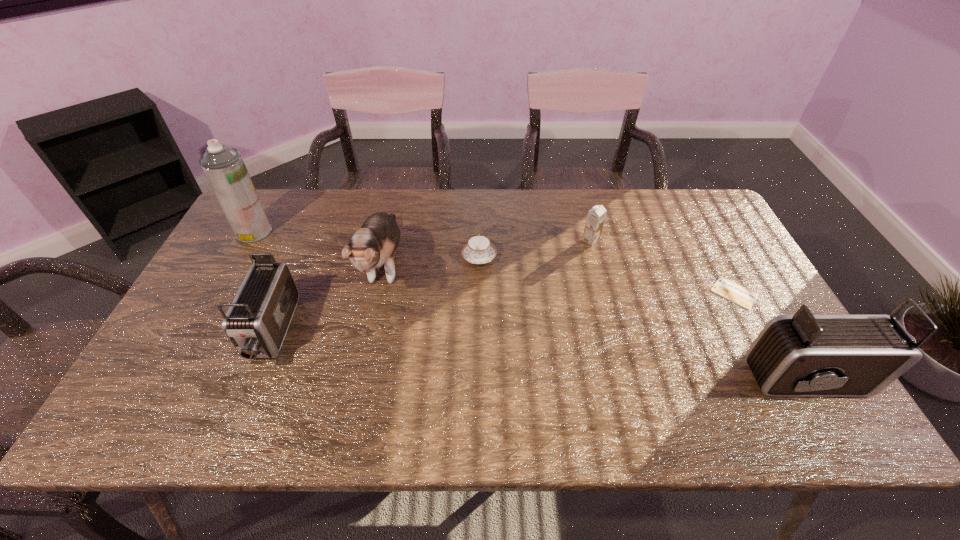
Identify the location of the second object from left to right. The width and height of the screenshot is (960, 540). (258, 319).

You are a GUI agent. You are given a task and a screenshot of the screen. Output one action in this format:
    pyautogui.click(x=<x>, y=<y>)
    Task: Click on the shorter camcorder
    This screenshot has height=540, width=960.
    Given the screenshot: What is the action you would take?
    pyautogui.click(x=258, y=319)

Locate an element on the screen. the right camcorder is located at coordinates (803, 355).

I want to click on the leftmost object, so click(x=224, y=168).

The image size is (960, 540). I want to click on aerosol can, so click(224, 168).

Where is `the third object from left to right`? This screenshot has height=540, width=960. the third object from left to right is located at coordinates (373, 245).

I want to click on the fourth object from left to right, so click(x=478, y=250).

I want to click on teacup, so click(x=478, y=250).

The image size is (960, 540). In order to click on chocolate milk in this screenshot , I will do `click(596, 216)`.

Locate an element on the screen. The width and height of the screenshot is (960, 540). the third shortest object is located at coordinates (596, 216).